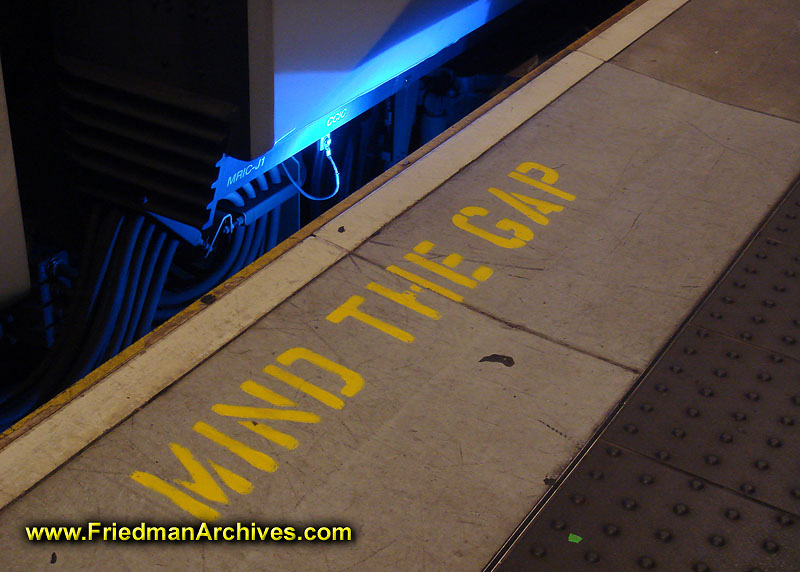
Locate an element on the screen. electric cord is located at coordinates (337, 181).